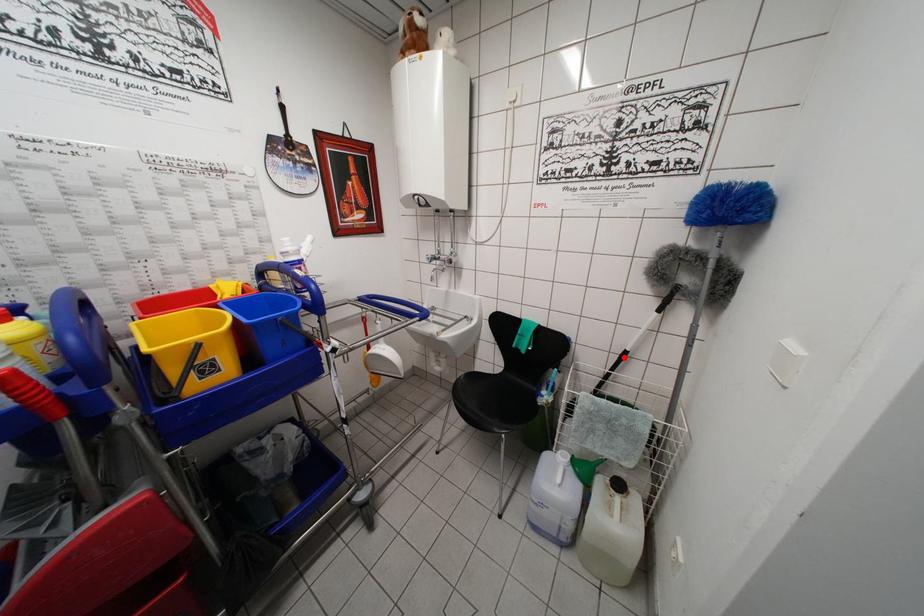
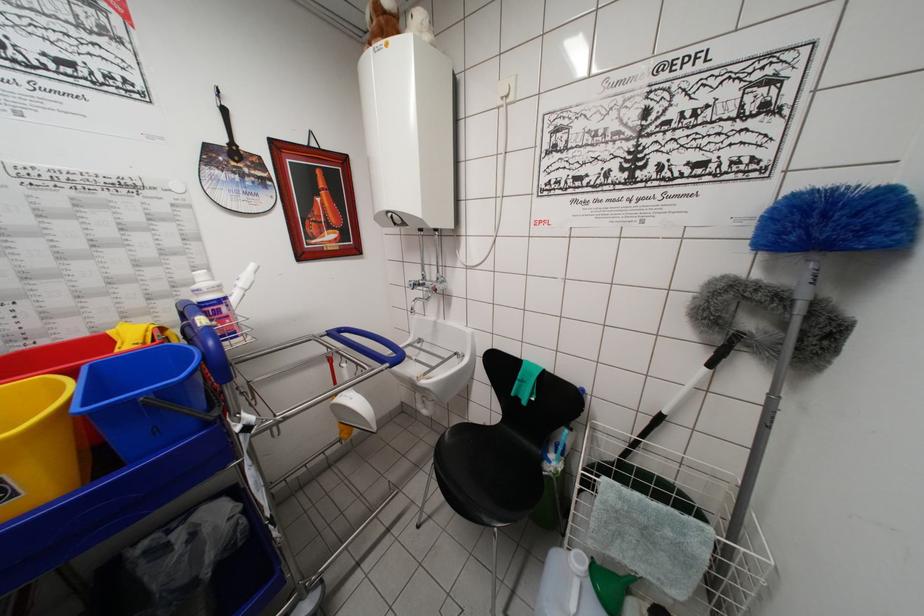
Locate, in the second image, the point that corresponds to the highlighted location in the first image.

(658, 419)